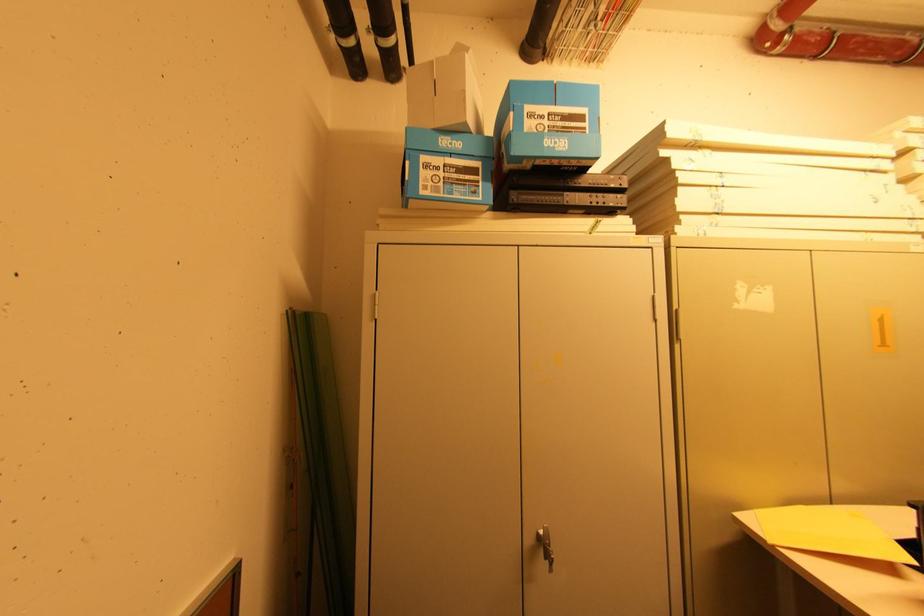
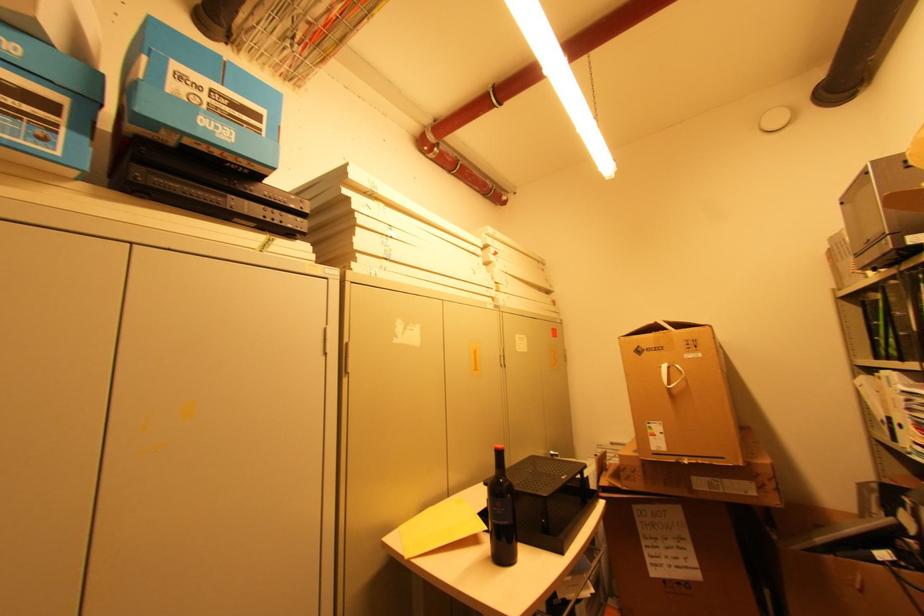
Locate, in the second image, the point that corresponds to point (587, 212) in the first image.

(258, 225)